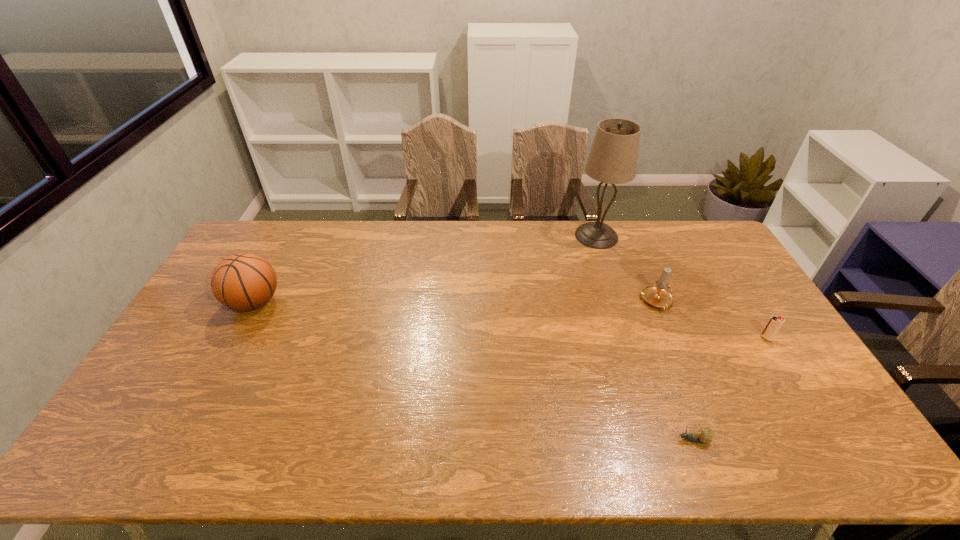
Find the location of a particular element. vacant space at the far edge of the desktop is located at coordinates (396, 242).

Locate an element on the screen. The height and width of the screenshot is (540, 960). vacant space at the near edge of the desktop is located at coordinates (731, 460).

At what (x,y) coordinates should I click in order to perform the action: click on vacant region at the left edge of the desktop. Please return your answer as a coordinate pair (x, y). The height and width of the screenshot is (540, 960). Looking at the image, I should click on (204, 347).

Where is `vacant region at the right edge of the desktop`? This screenshot has height=540, width=960. vacant region at the right edge of the desktop is located at coordinates (702, 282).

Find the location of a particular element. This screenshot has height=540, width=960. free space at the far left corner is located at coordinates [x=254, y=227].

At what (x,y) coordinates should I click in order to perform the action: click on vacant position at the far right corner of the desktop. Please return your answer as a coordinate pair (x, y). This screenshot has height=540, width=960. Looking at the image, I should click on (690, 258).

Find the location of `free space between the shortest object and the fourth tallest object`. free space between the shortest object and the fourth tallest object is located at coordinates (730, 389).

Where is `free space between the candle and the second nearest object`? The image size is (960, 540). free space between the candle and the second nearest object is located at coordinates (712, 320).

Locate an element on the screen. This screenshot has width=960, height=540. vacant region between the basketball and the tallest object is located at coordinates (425, 269).

Identify the location of free spot between the leftmost object and the fourth tallest object. (510, 320).